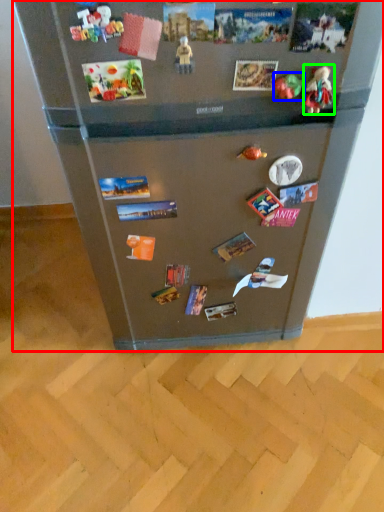
Question: Which object is the closest to the refrigerator (highlighted by a red box)? Choose among these: toy (highlighted by a blue box) or toy (highlighted by a green box).

Choices:
 (A) toy
 (B) toy

Answer: (A)